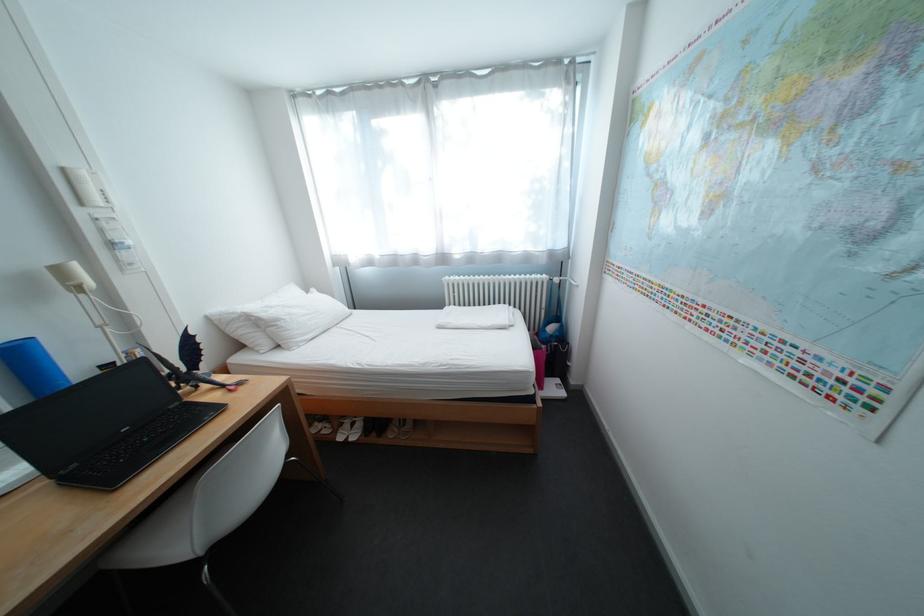
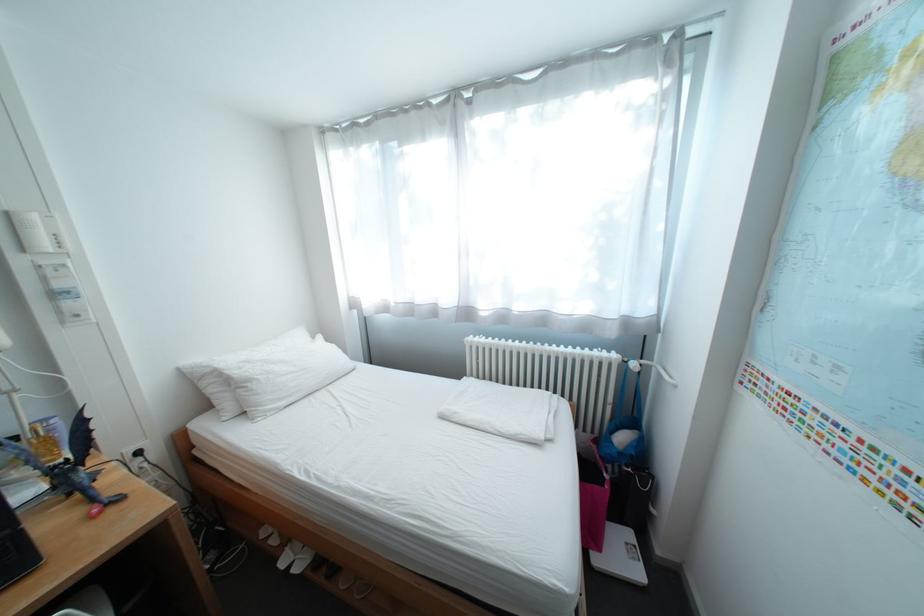
In the second image, find the point that corresponds to [210,387] in the first image.

(81, 495)